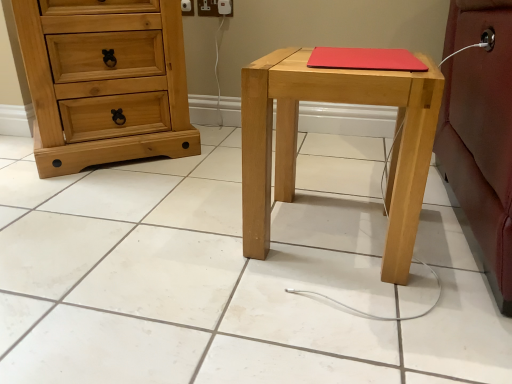
Question: Is natural wood chest of drawers at left bigger or smaller than natural wood stool at center?

Choices:
 (A) small
 (B) big

Answer: (B)

Question: In the image, is natural wood chest of drawers at left positioned in front of or behind natural wood stool at center?

Choices:
 (A) front
 (B) behind

Answer: (B)

Question: From the image's perspective, is natural wood chest of drawers at left located above or below natural wood stool at center?

Choices:
 (A) above
 (B) below

Answer: (A)

Question: Considering the positions of natural wood stool at center and natural wood chest of drawers at left in the image, is natural wood stool at center bigger or smaller than natural wood chest of drawers at left?

Choices:
 (A) small
 (B) big

Answer: (A)

Question: Does point (394, 248) appear closer or farther from the camera than point (177, 34)?

Choices:
 (A) closer
 (B) farther

Answer: (A)

Question: From a real-world perspective, relative to natural wood chest of drawers at left, is natural wood stool at center vertically above or below?

Choices:
 (A) above
 (B) below

Answer: (B)

Question: Is natural wood stool at center spatially inside natural wood chest of drawers at left, or outside of it?

Choices:
 (A) inside
 (B) outside

Answer: (B)